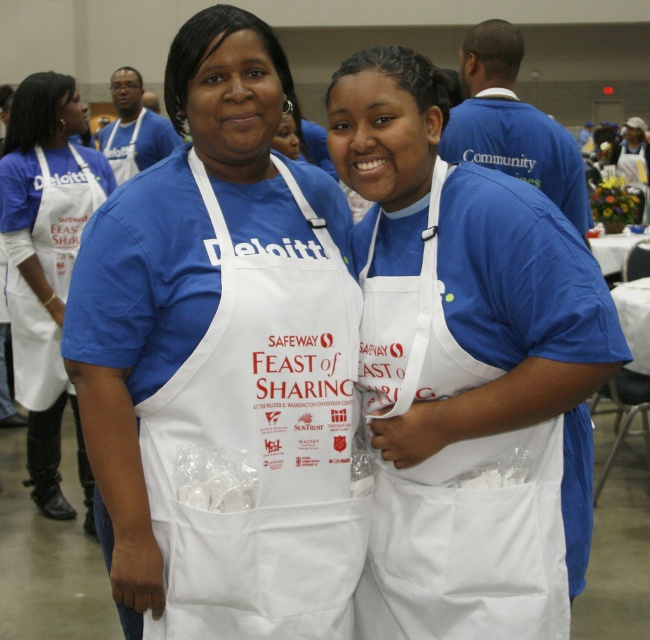
Question: Where is white matte apron at center located in relation to white paper apron at center in the image?

Choices:
 (A) above
 (B) below

Answer: (B)

Question: Considering the real-world distances, which object is farthest from the white fabric apron at center?

Choices:
 (A) white matte apron at center
 (B) white paper apron at center

Answer: (B)

Question: Which point is closer to the camera?

Choices:
 (A) (385, 605)
 (B) (166, 280)
 (C) (60, 252)

Answer: (B)

Question: Among these points, which one is farthest from the camera?

Choices:
 (A) click(x=16, y=364)
 (B) click(x=430, y=328)
 (C) click(x=300, y=224)

Answer: (A)

Question: Is white matte apron at center positioned in front of white paper apron at center?

Choices:
 (A) yes
 (B) no

Answer: (A)

Question: Is white fabric apron at center closer to camera compared to white paper apron at center?

Choices:
 (A) no
 (B) yes

Answer: (B)